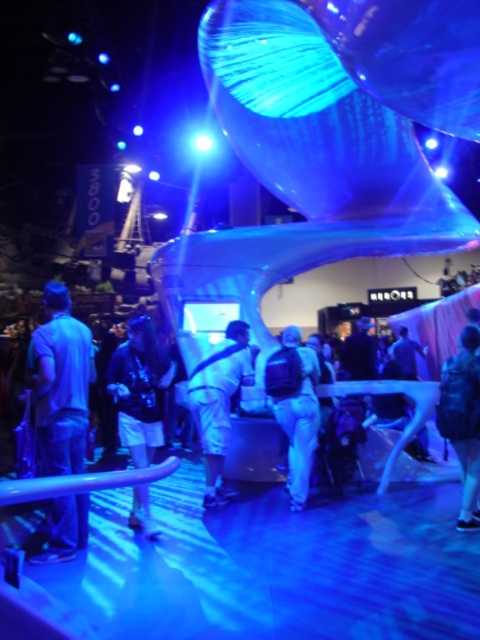
Question: Does denim shorts at center have a greater width compared to white cotton pants at center?

Choices:
 (A) no
 (B) yes

Answer: (A)

Question: Does white matte backpack at center appear over white cotton pants at center?

Choices:
 (A) yes
 (B) no

Answer: (B)

Question: Which object is farther from the camera taking this photo?

Choices:
 (A) leather jacket at lower right
 (B) denim shorts at center
 (C) matte blue shirt at left

Answer: (B)

Question: Where is matte blue shirt at left located in relation to white matte backpack at center in the image?

Choices:
 (A) right
 (B) left

Answer: (B)

Question: Among these points, which one is nearest to the camera?

Choices:
 (A) (60, 344)
 (B) (271, 394)
 (C) (212, 499)

Answer: (A)

Question: Which of the following is the farthest from the observer?

Choices:
 (A) matte blue shirt at left
 (B) white cotton pants at center
 (C) denim shorts at center

Answer: (B)